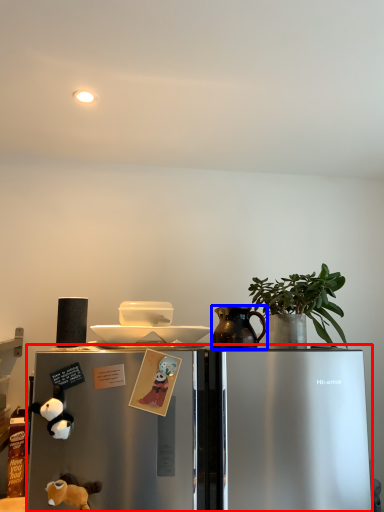
Question: Which object appears farthest to the camera in this image, refrigerator (highlighted by a red box) or jug (highlighted by a blue box)?

Choices:
 (A) refrigerator
 (B) jug

Answer: (B)